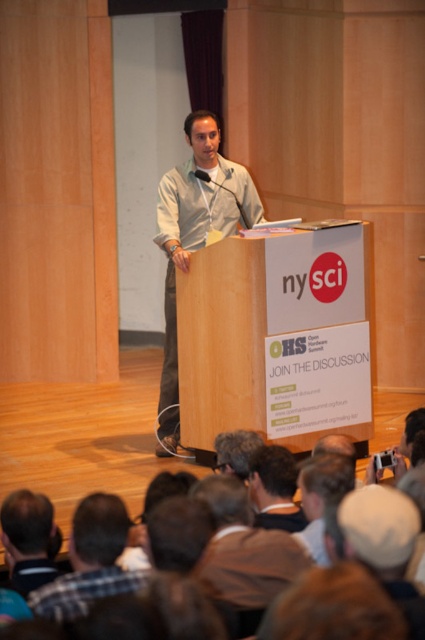
Does point (207, 170) come behind point (90, 577)?

Yes, it is.

Is light gray cotton shirt at center thinner than plaid fabric shirt at lower left?

In fact, light gray cotton shirt at center might be wider than plaid fabric shirt at lower left.

Identify the location of light gray cotton shirt at center. (195, 237).

Locate an element on the screen. The width and height of the screenshot is (425, 640). light gray cotton shirt at center is located at coordinates (195, 237).

Which is behind, point (11, 454) or point (158, 186)?

The point (11, 454) is behind.

Which is behind, point (144, 467) or point (170, 282)?

Positioned behind is point (170, 282).

Find the location of a particular element. brown fabric crowd at lower center is located at coordinates (79, 445).

Can you confirm if brown fabric crowd at lower center is bigger than plaid fabric shirt at lower left?

Indeed, brown fabric crowd at lower center has a larger size compared to plaid fabric shirt at lower left.

Is brown fabric crowd at lower center taller than plaid fabric shirt at lower left?

Indeed, brown fabric crowd at lower center has a greater height compared to plaid fabric shirt at lower left.

Which is behind, point (51, 493) or point (118, 536)?

Point (51, 493)

Where is `brown fabric crowd at lower center`? Image resolution: width=425 pixels, height=640 pixels. brown fabric crowd at lower center is located at coordinates (79, 445).